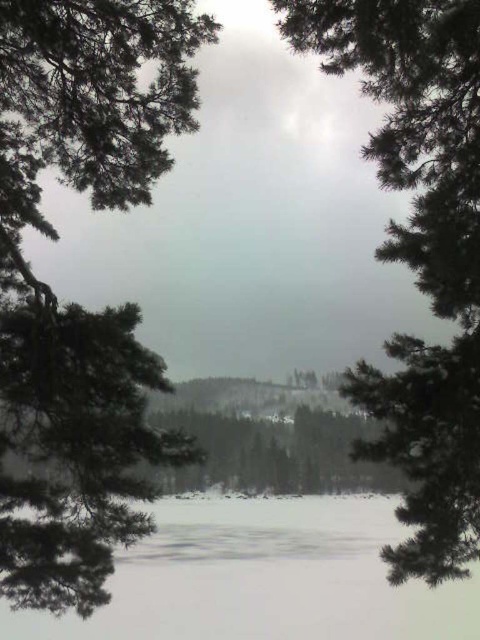
Question: Does green needle-like leaves at left have a smaller size compared to white ice at center?

Choices:
 (A) yes
 (B) no

Answer: (B)

Question: Estimate the real-world distances between objects in this image. Which object is closer to the green needle-like leaves at left?

Choices:
 (A) green matte tree at upper left
 (B) white ice at center

Answer: (B)

Question: Does green needle-like leaves at left have a lesser width compared to white ice at center?

Choices:
 (A) yes
 (B) no

Answer: (A)

Question: Among these points, which one is nearest to the camera?

Choices:
 (A) (51, 237)
 (B) (239, 600)

Answer: (B)

Question: Among these points, which one is farthest from the camera?

Choices:
 (A) (448, 68)
 (B) (307, 627)

Answer: (B)

Question: Is green needle-like leaves at left wider than green matte tree at upper left?

Choices:
 (A) yes
 (B) no

Answer: (A)